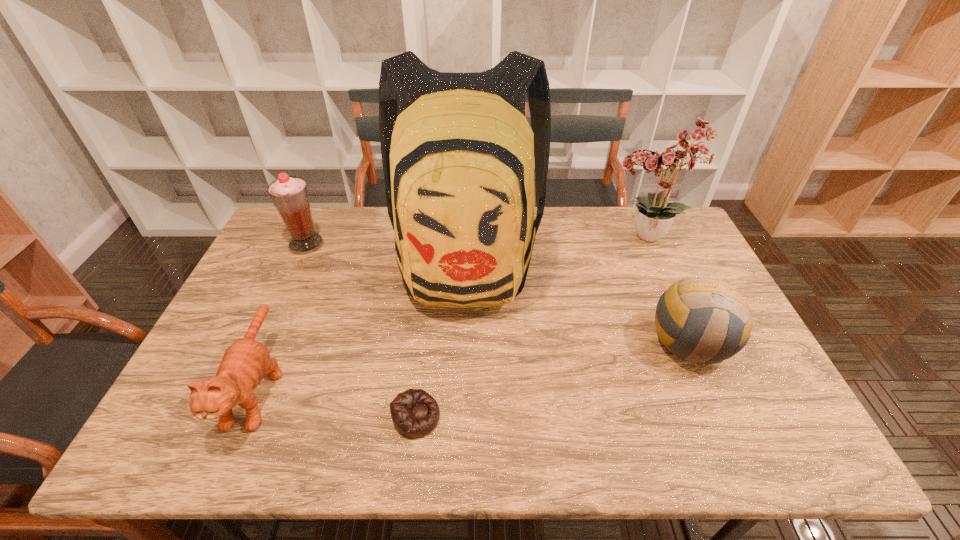
You are a GUI agent. You are given a task and a screenshot of the screen. Output one action in this format:
    pyautogui.click(x=<x>, y=<y>)
    Task: Click on the vacant space at the near right corner
    This screenshot has width=960, height=540.
    Given the screenshot: What is the action you would take?
    pyautogui.click(x=756, y=443)

You are a GUI agent. You are given a task and a screenshot of the screen. Output one action in this format:
    pyautogui.click(x=<x>, y=<y>)
    Task: Click on the free spot between the fifth shortest object and the backpack
    Image resolution: width=960 pixels, height=540 pixels.
    Given the screenshot: What is the action you would take?
    pyautogui.click(x=556, y=250)

The width and height of the screenshot is (960, 540). I want to click on free space that is in between the volleyball and the cat, so click(x=473, y=364).

What are the coordinates of `free space between the shortest object and the fourth shortest object` in the screenshot? It's located at (361, 330).

Locate an element on the screen. vacant space that is in between the volleyball and the backpack is located at coordinates (578, 302).

Image resolution: width=960 pixels, height=540 pixels. I want to click on vacant space that's between the cat and the flower arrangement, so click(451, 313).

Where is `vacant space that is in between the second tallest object and the tallest object`? The width and height of the screenshot is (960, 540). vacant space that is in between the second tallest object and the tallest object is located at coordinates (556, 250).

Locate an element on the screen. free space between the volleyball and the beanbag is located at coordinates (553, 379).

This screenshot has width=960, height=540. Identify the location of free space between the volleyball and the cat. (473, 364).

Find the location of `vacant space in between the backpack and the volleyball`. vacant space in between the backpack and the volleyball is located at coordinates (578, 302).